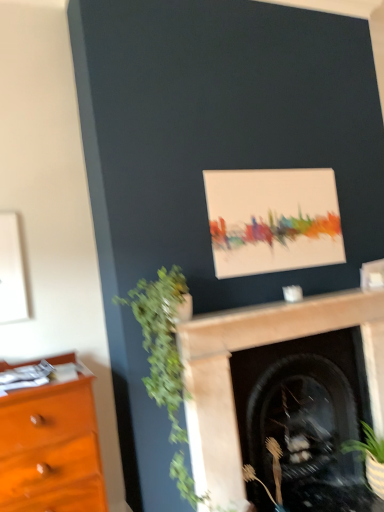
Question: Considering their positions, is matte canvas painting at upper center located in front of or behind brown textured plant at lower center, the 1th plant when ordered from bottom to top?

Choices:
 (A) behind
 (B) front

Answer: (A)

Question: Visually, is matte canvas painting at upper center positioned to the left or to the right of brown textured plant at lower center, the 2th plant viewed from the left?

Choices:
 (A) right
 (B) left

Answer: (A)

Question: Estimate the real-world distances between objects in this image. Which object is closer to the matte canvas painting at upper center?

Choices:
 (A) brown textured plant at lower center, the 2th plant when ordered from top to bottom
 (B) smooth stone fireplace at center
 (C) green leafy plant at left, arranged as the 2th plant when viewed from the right

Answer: (B)

Question: Which object is the closest to the matte canvas painting at upper center?

Choices:
 (A) brown textured plant at lower center, acting as the first plant starting from the right
 (B) smooth stone fireplace at center
 (C) green leafy plant at left, which is the first plant in top-to-bottom order

Answer: (B)